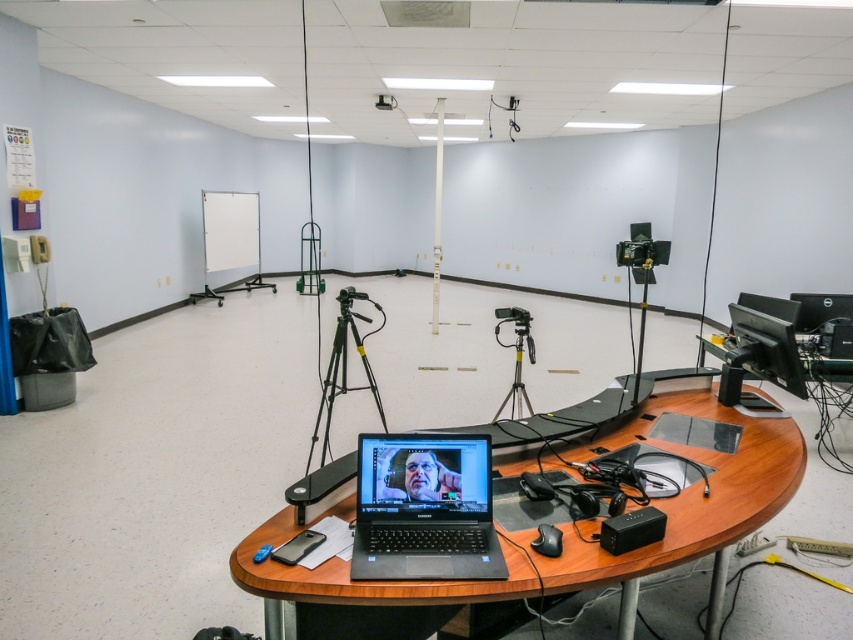
Question: Considering the real-world distances, which object is farthest from the black matte tripod at center?

Choices:
 (A) silver metallic tripod at center
 (B) black plastic projector at upper center
 (C) black matte laptop at center
 (D) wooden round table at center

Answer: (B)

Question: Does black matte laptop at center appear over black plastic projector at upper center?

Choices:
 (A) yes
 (B) no

Answer: (B)

Question: Which point is closer to the camera taking this photo?

Choices:
 (A) (521, 544)
 (B) (511, 404)
 (C) (370, 563)
 (D) (387, 97)

Answer: (C)

Question: Does wooden round table at center appear under black plastic projector at upper center?

Choices:
 (A) yes
 (B) no

Answer: (A)

Question: Among these points, which one is farthest from the camera?

Choices:
 (A) (383, 108)
 (B) (274, 570)
 (C) (334, 356)
 (D) (532, 349)

Answer: (A)

Question: Does black matte laptop at center appear on the left side of black matte tripod at center?

Choices:
 (A) yes
 (B) no

Answer: (B)